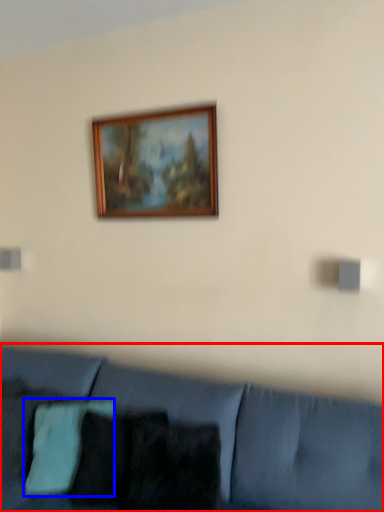
Question: Which object appears closest to the camera in this image, studio couch (highlighted by a red box) or pillow (highlighted by a blue box)?

Choices:
 (A) studio couch
 (B) pillow

Answer: (A)